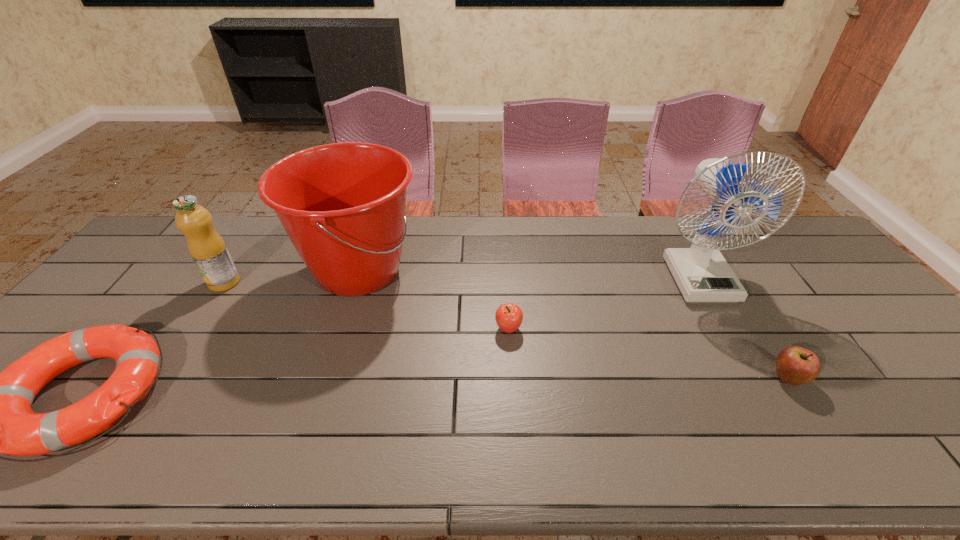
The image size is (960, 540). I want to click on the tallest object, so click(x=702, y=274).

The width and height of the screenshot is (960, 540). I want to click on bucket, so click(x=342, y=205).

The width and height of the screenshot is (960, 540). What are the coordinates of `the third tallest object` in the screenshot? It's located at (207, 248).

This screenshot has width=960, height=540. In order to click on the taller apple in this screenshot , I will do (x=795, y=365).

The width and height of the screenshot is (960, 540). What are the coordinates of `the third shortest object` in the screenshot? It's located at (795, 365).

Locate an element on the screen. the farther apple is located at coordinates (509, 317).

The image size is (960, 540). In order to click on the shorter apple in this screenshot , I will do pos(509,317).

The width and height of the screenshot is (960, 540). I want to click on vacant space located 0.100m on the front-facing side of the tallest object, so point(728,331).

This screenshot has height=540, width=960. In order to click on free spot located 0.140m with the handle attached to the rim of the third object from left to right in this screenshot , I will do `click(468, 271)`.

The image size is (960, 540). What are the coordinates of `free region located on the front label of the fruit juice` in the screenshot? It's located at (175, 357).